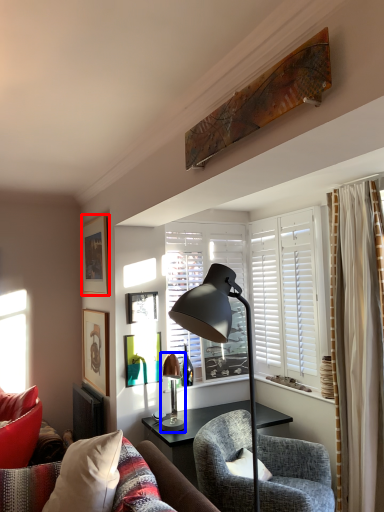
Question: Which of the following is the farthest to the observer, picture frame (highlighted by a red box) or lamp (highlighted by a blue box)?

Choices:
 (A) picture frame
 (B) lamp

Answer: (A)